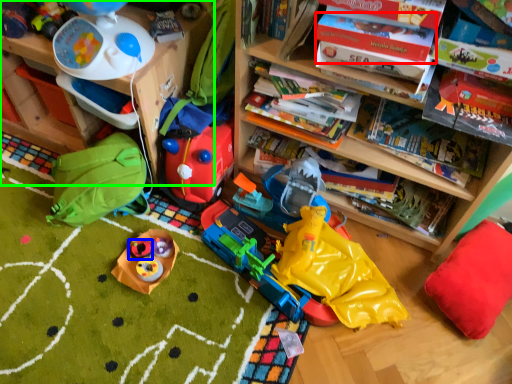
Question: Considering the real-world distances, which object is closest to book (highlighted by a red box)? toy (highlighted by a blue box) or shelf (highlighted by a green box).

Choices:
 (A) toy
 (B) shelf

Answer: (B)